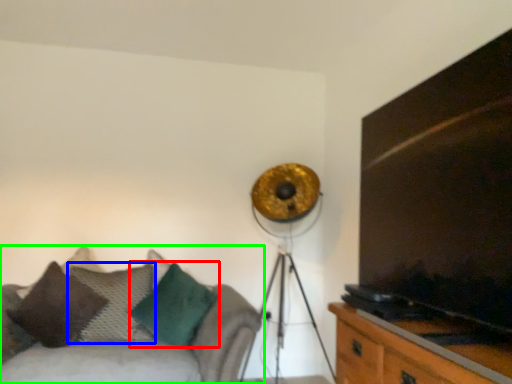
Question: Estimate the real-world distances between objects in this image. Which object is farther from pillow (highlighted by a red box), pillow (highlighted by a blue box) or studio couch (highlighted by a green box)?

Choices:
 (A) pillow
 (B) studio couch

Answer: (B)